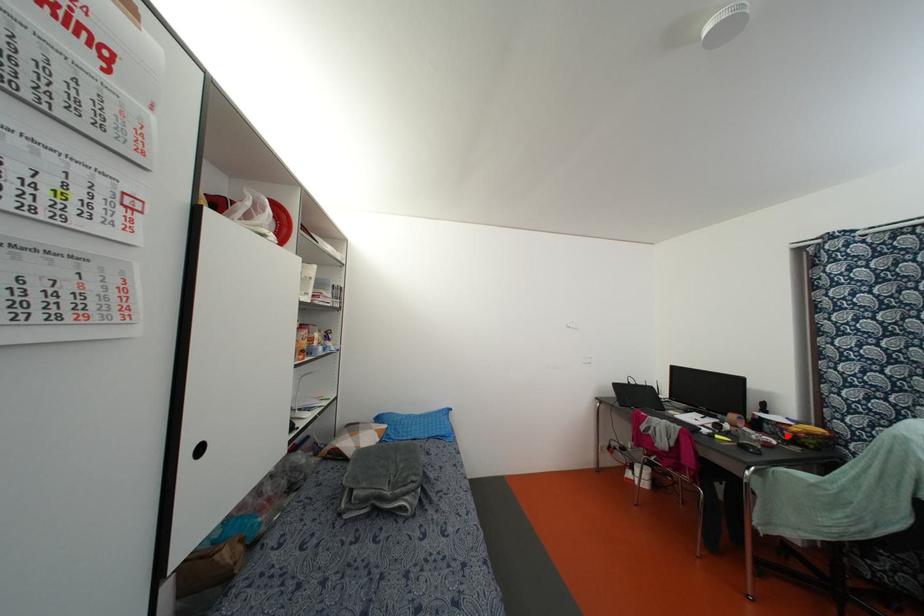
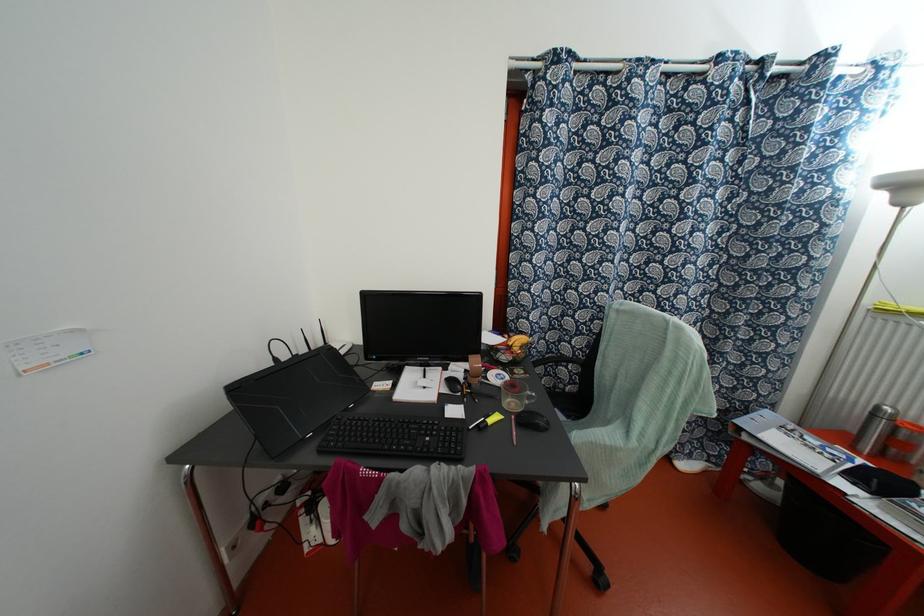
Where in the second image is the point corresponding to the highlighted location from the first image?

(504, 357)